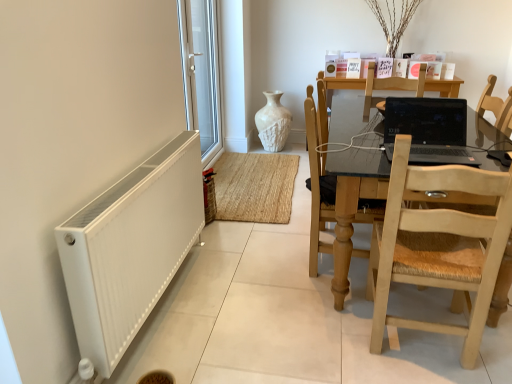
Locate an element on the screen. free region under white matte radiator at lower left (from a real-world perspective) is located at coordinates (163, 315).